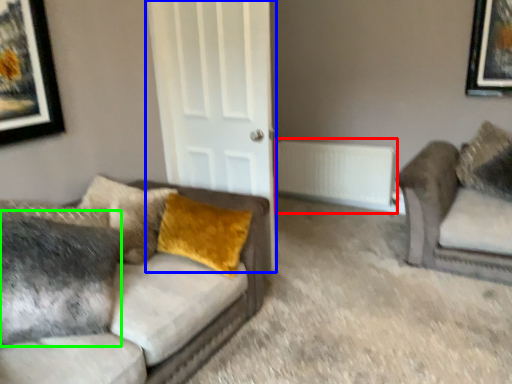
Question: Considering the real-world distances, which object is farthest from radiator (highlighted by a red box)? door (highlighted by a blue box) or pillow (highlighted by a green box)?

Choices:
 (A) door
 (B) pillow

Answer: (B)